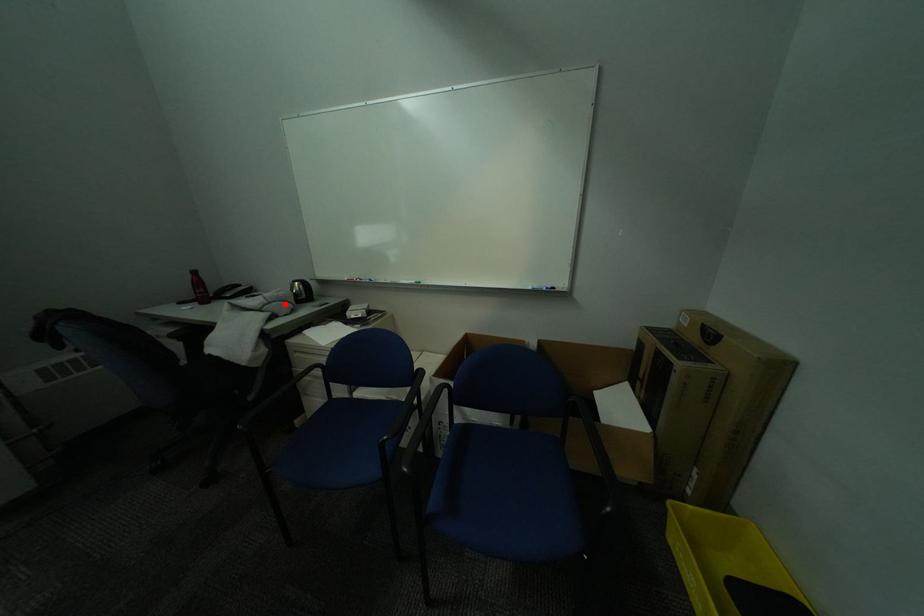
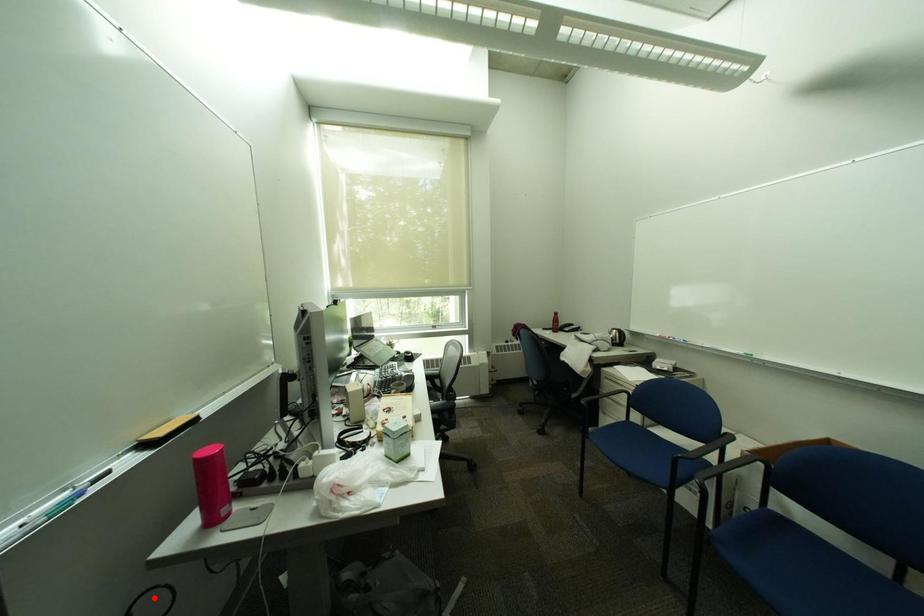
I am providing you with two images of the same scene from different viewpoints. A red point is marked on the first image and another point is marked on the second image. Do the highlighted points in image1 and image2 indicate the same real-world spot?

No